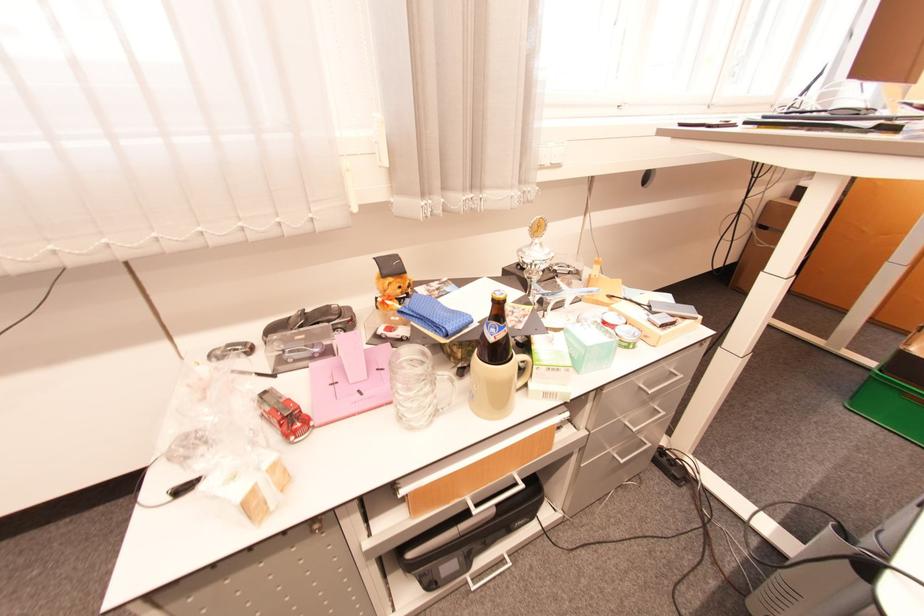
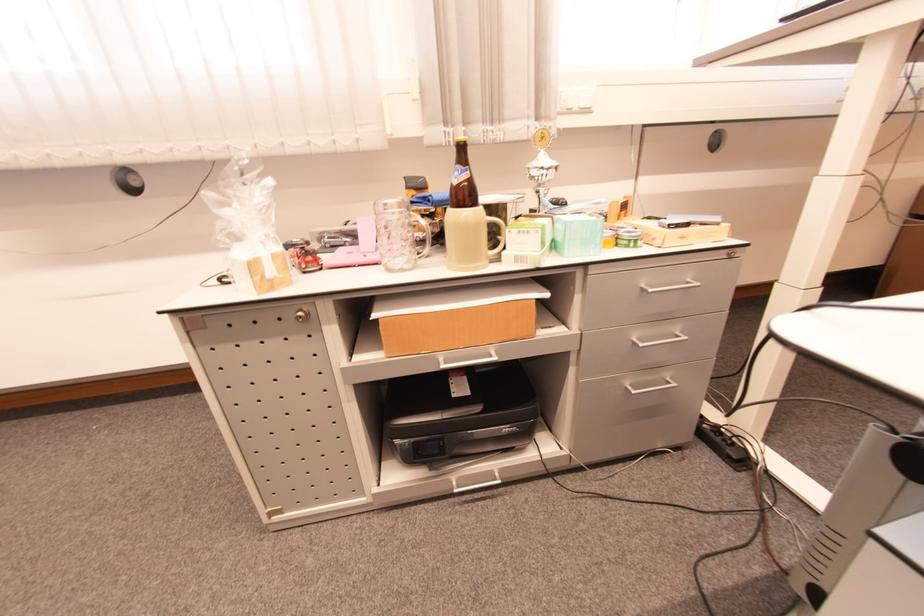
Question: The images are taken continuously from a first-person perspective. In which direction are you moving?

Choices:
 (A) Left
 (B) Right
 (C) Forward
 (D) Backward

Answer: (B)